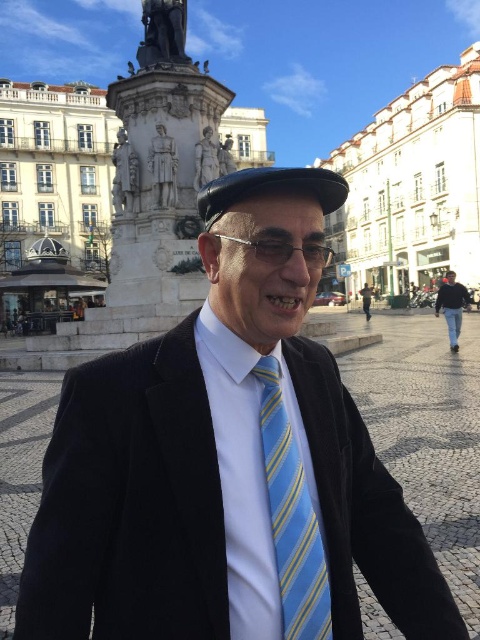
Who is taller, black velvet suit at center or black cotton jacket at right?

Standing taller between the two is black velvet suit at center.

The image size is (480, 640). Describe the element at coordinates (226, 472) in the screenshot. I see `black velvet suit at center` at that location.

Is point (342, 483) farther from camera compared to point (442, 296)?

That is False.

Locate an element on the screen. black velvet suit at center is located at coordinates (226, 472).

Is point (171, 564) positioned after point (284, 509)?

No, (171, 564) is in front of (284, 509).

Which is more to the right, black velvet suit at center or blue striped tie at center?

blue striped tie at center is more to the right.

The height and width of the screenshot is (640, 480). What do you see at coordinates (226, 472) in the screenshot? I see `black velvet suit at center` at bounding box center [226, 472].

The image size is (480, 640). Find the location of `black velvet suit at center`. black velvet suit at center is located at coordinates (226, 472).

Between black velvet suit at center and leather cap at center, which one appears on the right side from the viewer's perspective?

From the viewer's perspective, leather cap at center appears more on the right side.

Who is more distant from viewer, (181, 545) or (217, 212)?

The point (217, 212) is more distant.

Is point (372, 515) farther from viewer compared to point (331, 193)?

That is False.

In order to click on black velvet suit at center in this screenshot , I will do `click(226, 472)`.